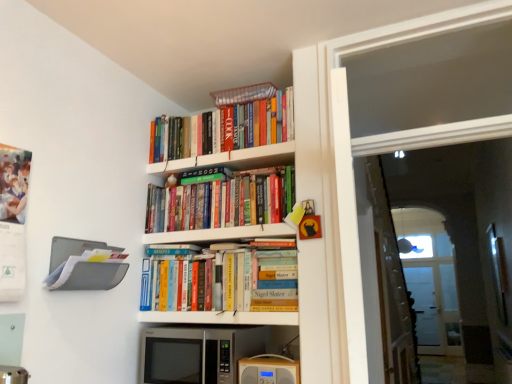
Measure the distance between point (276, 362) and camera.

The distance of point (276, 362) from camera is 6.72 feet.

Find the location of a particular element. hardcover books at upper center, the 1th book when ordered from top to bottom is located at coordinates (224, 129).

The height and width of the screenshot is (384, 512). What do you see at coordinates (224, 129) in the screenshot?
I see `hardcover books at upper center, placed as the third book when sorted from bottom to top` at bounding box center [224, 129].

At what (x,y) coordinates should I click in order to perform the action: click on transparent plastic screen door at right. Please return your answer as a coordinate pair (x, y). This screenshot has width=512, height=384. Looking at the image, I should click on (424, 304).

Describe the element at coordinates (197, 354) in the screenshot. I see `silver metallic microwave at lower center` at that location.

At what (x,y) coordinates should I click in order to perform the action: click on white glossy bookshelf at upper center, marked as the third shelf in a bottom-to-top arrangement. Please return your answer as a coordinate pair (x, y). Looking at the image, I should click on (221, 234).

Can you confirm if white glossy bookshelf at upper center, marked as the third shelf in a bottom-to-top arrangement, is positioned to the right of gray plastic file organizer at left, the 2th shelf ordered from the bottom?

Indeed, white glossy bookshelf at upper center, marked as the third shelf in a bottom-to-top arrangement, is positioned on the right side of gray plastic file organizer at left, the 2th shelf ordered from the bottom.

From a real-world perspective, is white glossy bookshelf at upper center, which is the 2th shelf in top-to-bottom order, over gray plastic file organizer at left, acting as the third shelf starting from the top?

Yes.

Is white glossy bookshelf at upper center, marked as the third shelf in a bottom-to-top arrangement, inside or outside of gray plastic file organizer at left, acting as the third shelf starting from the top?

white glossy bookshelf at upper center, marked as the third shelf in a bottom-to-top arrangement, is spatially situated outside gray plastic file organizer at left, acting as the third shelf starting from the top.

Is white glossy bookshelf at upper center, which is the 2th shelf in top-to-bottom order, next to gray plastic file organizer at left, acting as the third shelf starting from the top?

No, white glossy bookshelf at upper center, which is the 2th shelf in top-to-bottom order, is not next to gray plastic file organizer at left, acting as the third shelf starting from the top.

Is hardcover books at center, positioned as the 1th shelf in bottom-to-top order, at the back of hardcover books at center, the third book from the top?

hardcover books at center, the third book from the top, is not turned away from hardcover books at center, positioned as the 1th shelf in bottom-to-top order.

What's the angular difference between hardcover books at center, the third book from the top, and hardcover books at center, the fourth shelf when ordered from top to bottom,'s facing directions?

hardcover books at center, the third book from the top, and hardcover books at center, the fourth shelf when ordered from top to bottom, are facing 1.74 degrees away from each other.

Identify the location of shelf beneath the hardcover books at center, the third book from the top (from a real-world perspective). This screenshot has height=384, width=512. (220, 317).

Does hardcover books at center, which ranks as the first book in bottom-to-top order, touch hardcover books at center, the fourth shelf when ordered from top to bottom?

No, hardcover books at center, which ranks as the first book in bottom-to-top order, is not touching hardcover books at center, the fourth shelf when ordered from top to bottom.

How different are the orientations of wooden radio at lower center and hardcover books at upper center, positioned as the second book in bottom-to-top order, in degrees?

They differ by 3.03 degrees in their facing directions.

Does point (273, 367) come closer to viewer compared to point (221, 224)?

Yes, it is in front of point (221, 224).

Does wooden radio at lower center appear on the left side of hardcover books at upper center, the 2th book when ordered from top to bottom?

No, wooden radio at lower center is not to the left of hardcover books at upper center, the 2th book when ordered from top to bottom.

Could you tell me if hardcover books at upper center, which ranks as the first shelf in top-to-bottom order, is facing transparent glass door at upper right?

No, hardcover books at upper center, which ranks as the first shelf in top-to-bottom order, is not aimed at transparent glass door at upper right.

Considering the points (256, 153) and (371, 41), which point is behind, point (256, 153) or point (371, 41)?

Positioned behind is point (256, 153).

From a real-world perspective, relative to transparent glass door at upper right, is hardcover books at upper center, which ranks as the first shelf in top-to-bottom order, vertically above or below?

In terms of real-world spatial position, hardcover books at upper center, which ranks as the first shelf in top-to-bottom order, is above transparent glass door at upper right.

How different are the orientations of hardcover books at upper center, which ranks as the first shelf in top-to-bottom order, and transparent glass door at upper right in degrees?

The angle between the facing direction of hardcover books at upper center, which ranks as the first shelf in top-to-bottom order, and the facing direction of transparent glass door at upper right is 0.0225 degrees.

From a real-world perspective, does silver metallic microwave at lower center sit lower than transparent plastic screen door at right?

No, from a real-world perspective, silver metallic microwave at lower center is not beneath transparent plastic screen door at right.

Which object is closer to the camera taking this photo, silver metallic microwave at lower center or transparent plastic screen door at right?

silver metallic microwave at lower center is closer to the camera.

Can you confirm if silver metallic microwave at lower center is shorter than transparent plastic screen door at right?

Correct, silver metallic microwave at lower center is not as tall as transparent plastic screen door at right.

Is silver metallic microwave at lower center oriented away from transparent plastic screen door at right?

That's right, silver metallic microwave at lower center is facing away from transparent plastic screen door at right.

Is hardcover books at center, the third book from the top, at the back of wooden radio at lower center?

No, wooden radio at lower center is not facing away from hardcover books at center, the third book from the top.

Is wooden radio at lower center to the left of hardcover books at center, which ranks as the first book in bottom-to-top order, from the viewer's perspective?

No.

From a real-world perspective, which object rests below the other?

From a 3D spatial view, wooden radio at lower center is below.

Is wooden radio at lower center closer to the viewer compared to hardcover books at center, which ranks as the first book in bottom-to-top order?

Yes, wooden radio at lower center is closer to the camera.

From a real-world perspective, relative to wooden radio at lower center, is silver metallic microwave at lower center vertically above or below?

silver metallic microwave at lower center is situated higher than wooden radio at lower center in the real world.

How many degrees apart are the facing directions of silver metallic microwave at lower center and wooden radio at lower center?

silver metallic microwave at lower center and wooden radio at lower center are facing 1.87 degrees away from each other.

Could you tell me if silver metallic microwave at lower center is facing wooden radio at lower center?

No, silver metallic microwave at lower center is not oriented towards wooden radio at lower center.

Considering the relative sizes of silver metallic microwave at lower center and wooden radio at lower center in the image provided, is silver metallic microwave at lower center taller than wooden radio at lower center?

Correct, silver metallic microwave at lower center is much taller as wooden radio at lower center.

From a real-world perspective, count 1st shelfs upward from the gray plastic file organizer at left, acting as the third shelf starting from the top, and point to it. Please provide its 2D coordinates.

[(221, 234)]

Starting from the hardcover books at center, which ranks as the first book in bottom-to-top order, which shelf is the 1st one in front? Please provide its 2D coordinates.

[(220, 317)]

When comparing their distances from gray plastic file organizer at left, the 2th shelf ordered from the bottom, does silver metallic microwave at lower center or hardcover books at center, which ranks as the first book in bottom-to-top order, seem further?

Among the two, silver metallic microwave at lower center is located further to gray plastic file organizer at left, the 2th shelf ordered from the bottom.

Looking at the image, which one is located closer to wooden radio at lower center, hardcover books at upper center, the 2th book when ordered from top to bottom, or transparent glass door at upper right?

Based on the image, transparent glass door at upper right appears to be nearer to wooden radio at lower center.

Looking at the image, which one is located further to hardcover books at center, the third book from the top, hardcover books at center, the fourth shelf when ordered from top to bottom, or hardcover books at upper center, the 1th book when ordered from top to bottom?

hardcover books at upper center, the 1th book when ordered from top to bottom.

Estimate the real-world distances between objects in this image. Which object is further from transparent plastic screen door at right, silver metallic microwave at lower center or hardcover books at center, positioned as the 1th shelf in bottom-to-top order?

hardcover books at center, positioned as the 1th shelf in bottom-to-top order, is further to transparent plastic screen door at right.

Looking at the image, which one is located closer to white glossy bookshelf at upper center, marked as the third shelf in a bottom-to-top arrangement, wooden radio at lower center or transparent plastic screen door at right?

Based on the image, wooden radio at lower center appears to be nearer to white glossy bookshelf at upper center, marked as the third shelf in a bottom-to-top arrangement.

Estimate the real-world distances between objects in this image. Which object is closer to transparent glass door at upper right, hardcover books at upper center, positioned as the second book in bottom-to-top order, or silver metallic microwave at lower center?

The object closer to transparent glass door at upper right is hardcover books at upper center, positioned as the second book in bottom-to-top order.

Looking at the image, which one is located closer to transparent plastic screen door at right, white glossy bookshelf at upper center, marked as the third shelf in a bottom-to-top arrangement, or hardcover books at center, positioned as the 1th shelf in bottom-to-top order?

Based on the image, hardcover books at center, positioned as the 1th shelf in bottom-to-top order, appears to be nearer to transparent plastic screen door at right.

Based on the photo, which object lies further to the anchor point hardcover books at center, which ranks as the first book in bottom-to-top order, transparent glass door at upper right or silver metallic microwave at lower center?

transparent glass door at upper right lies further to hardcover books at center, which ranks as the first book in bottom-to-top order, than the other object.

Where is `shelf located between white glossy bookshelf at upper center, which is the 2th shelf in top-to-bottom order, and transparent plastic screen door at right in the depth direction`? The image size is (512, 384). shelf located between white glossy bookshelf at upper center, which is the 2th shelf in top-to-bottom order, and transparent plastic screen door at right in the depth direction is located at coordinates (232, 159).

Find the location of a particular element. This screenshot has height=384, width=512. window between hardcover books at upper center, which ranks as the first shelf in top-to-bottom order, and silver metallic microwave at lower center, in the vertical direction is located at coordinates (352, 172).

The height and width of the screenshot is (384, 512). In order to click on microwave oven between gray plastic file organizer at left, acting as the third shelf starting from the top, and hardcover books at center, the fourth shelf when ordered from top to bottom, from left to right in this screenshot , I will do `click(197, 354)`.

At what (x,y) coordinates should I click in order to perform the action: click on appliance located between gray plastic file organizer at left, the 2th shelf ordered from the bottom, and transparent glass door at upper right in the left-right direction. Please return your answer as a coordinate pair (x, y). Looking at the image, I should click on (268, 370).